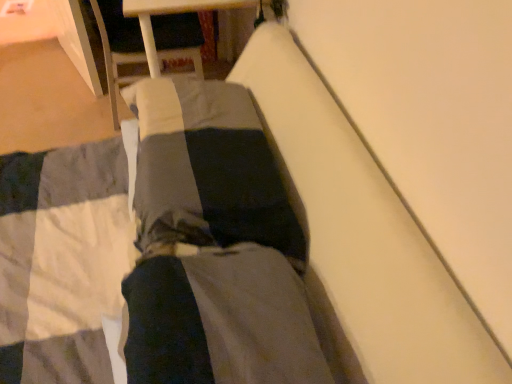
Question: Considering the positions of dark gray cotton pants at center and dark gray fabric at center in the image, is dark gray cotton pants at center bigger or smaller than dark gray fabric at center?

Choices:
 (A) small
 (B) big

Answer: (A)

Question: In terms of width, does dark gray cotton pants at center look wider or thinner when compared to dark gray fabric at center?

Choices:
 (A) wide
 (B) thin

Answer: (A)

Question: Is dark gray cotton pants at center taller or shorter than dark gray fabric at center?

Choices:
 (A) short
 (B) tall

Answer: (B)

Question: From the image's perspective, is dark gray fabric at center positioned above or below dark gray cotton pants at center?

Choices:
 (A) above
 (B) below

Answer: (A)

Question: Is dark gray fabric at center inside the boundaries of dark gray cotton pants at center, or outside?

Choices:
 (A) inside
 (B) outside

Answer: (B)

Question: In terms of size, does dark gray fabric at center appear bigger or smaller than dark gray cotton pants at center?

Choices:
 (A) small
 (B) big

Answer: (B)

Question: Is dark gray fabric at center taller or shorter than dark gray cotton pants at center?

Choices:
 (A) short
 (B) tall

Answer: (A)